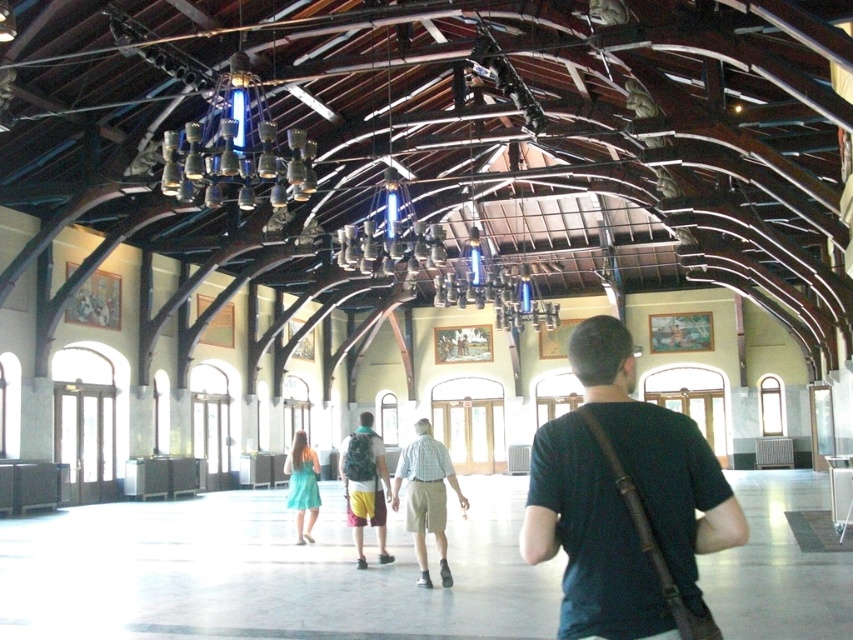
Question: Can you confirm if light blue plaid shirt at center is positioned to the right of teal fabric dress at center?

Choices:
 (A) no
 (B) yes

Answer: (B)

Question: Which of the following is the farthest from the observer?

Choices:
 (A) camouflage backpack at center
 (B) light blue plaid shirt at center
 (C) black leather bag at center

Answer: (A)

Question: Can you confirm if black leather bag at center is smaller than camouflage backpack at center?

Choices:
 (A) yes
 (B) no

Answer: (A)

Question: Among these points, which one is nearest to the camera?

Choices:
 (A) 309,488
 (B) 418,465

Answer: (B)

Question: Among these objects, which one is farthest from the camera?

Choices:
 (A) camouflage backpack at center
 (B) light blue plaid shirt at center
 (C) black leather bag at center

Answer: (A)

Question: In this image, where is camouflage backpack at center located relative to teal fabric dress at center?

Choices:
 (A) left
 (B) right

Answer: (B)